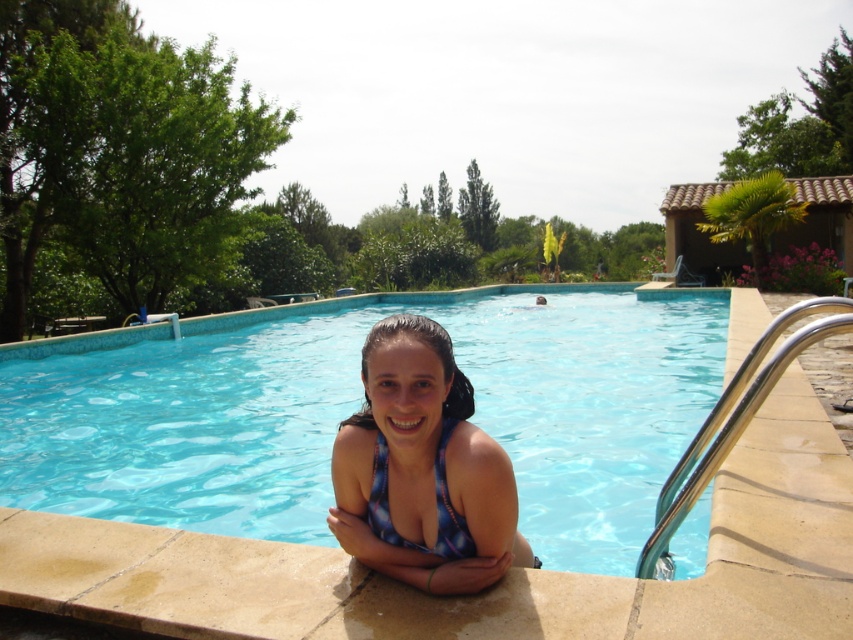
You are designing a new swimsuit collection and want to ensure proper fit. Given the blue printed swimsuit at center and the blue printed bikini top at center, which one has a wider design?

The blue printed swimsuit at center is wider than the blue printed bikini top at center according to the description.

You are a photographer trying to capture the blue glossy pool at center and the blue printed swimsuit at center in a single shot. Which object should you focus on first if you want to ensure both are in frame without moving the camera?

The blue glossy pool at center is much taller than the blue printed swimsuit at center, so focusing on the pool first will help ensure the swimsuit is also in frame.